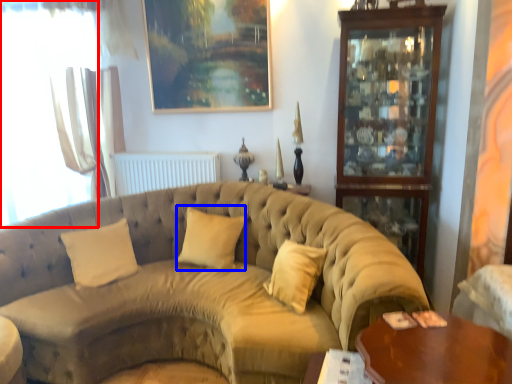
Question: Which of the following is the closest to the observer, window (highlighted by a red box) or pillow (highlighted by a blue box)?

Choices:
 (A) window
 (B) pillow

Answer: (B)